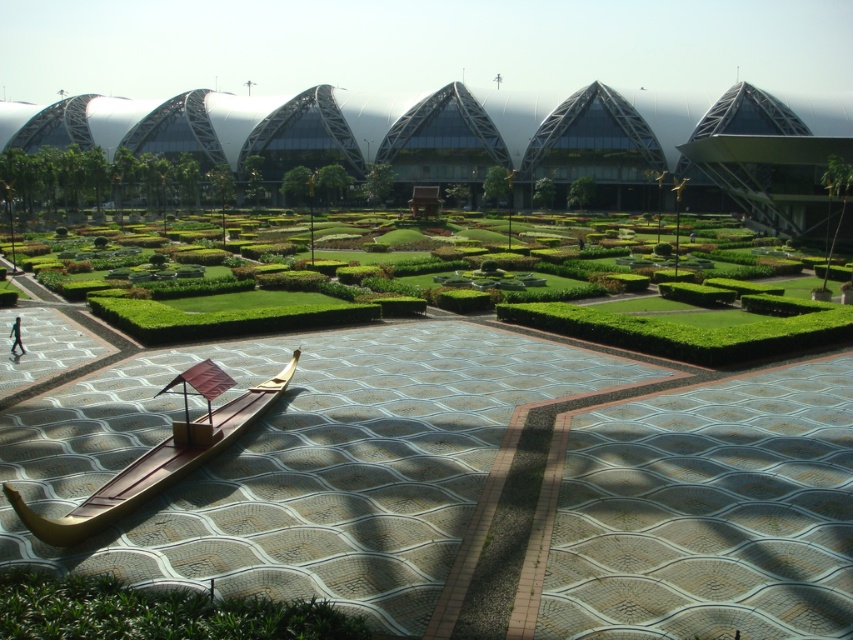
Is green leafy hedge at lower left further to camera compared to wooden boat at lower left?

No, it is not.

Does green leafy hedge at lower left come in front of wooden boat at lower left?

That is True.

Who is more distant from viewer, (18, 579) or (254, 403)?

The point (254, 403) is behind.

Image resolution: width=853 pixels, height=640 pixels. What are the coordinates of `green leafy hedge at lower left` in the screenshot? It's located at (155, 612).

Who is lower down, green leafy hedge at lower left or skinny person at center?

green leafy hedge at lower left

Is green leafy hedge at lower left positioned behind skinny person at center?

No.

What do you see at coordinates (155, 612) in the screenshot?
I see `green leafy hedge at lower left` at bounding box center [155, 612].

This screenshot has height=640, width=853. I want to click on green leafy hedge at lower left, so click(155, 612).

Who is higher up, wooden boat at lower left or skinny person at center?

skinny person at center

Who is positioned more to the left, wooden boat at lower left or skinny person at center?

skinny person at center

Where is `wooden boat at lower left`? wooden boat at lower left is located at coordinates (152, 467).